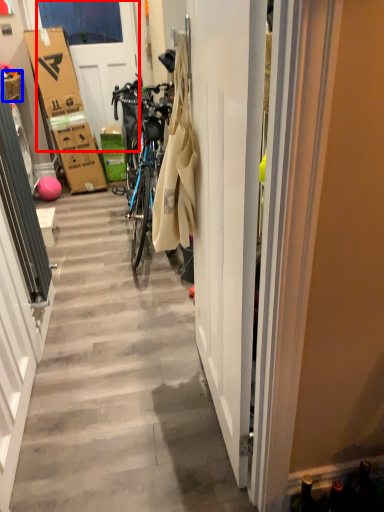
Question: Which of the following is the farthest to the observer, door (highlighted by a red box) or picnic basket (highlighted by a blue box)?

Choices:
 (A) door
 (B) picnic basket

Answer: (A)